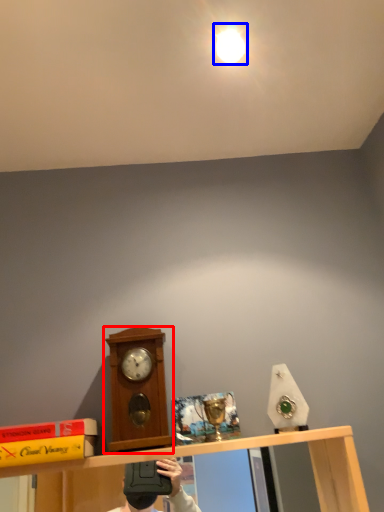
Question: Which of the following is the closest to the observer, clock (highlighted by a red box) or light (highlighted by a blue box)?

Choices:
 (A) clock
 (B) light

Answer: (A)